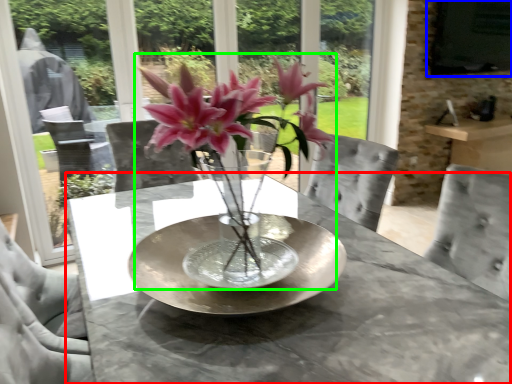
Question: Considering the real-world distances, which object is closest to table (highlighted by a red box)? window screen (highlighted by a blue box) or houseplant (highlighted by a green box).

Choices:
 (A) window screen
 (B) houseplant

Answer: (B)